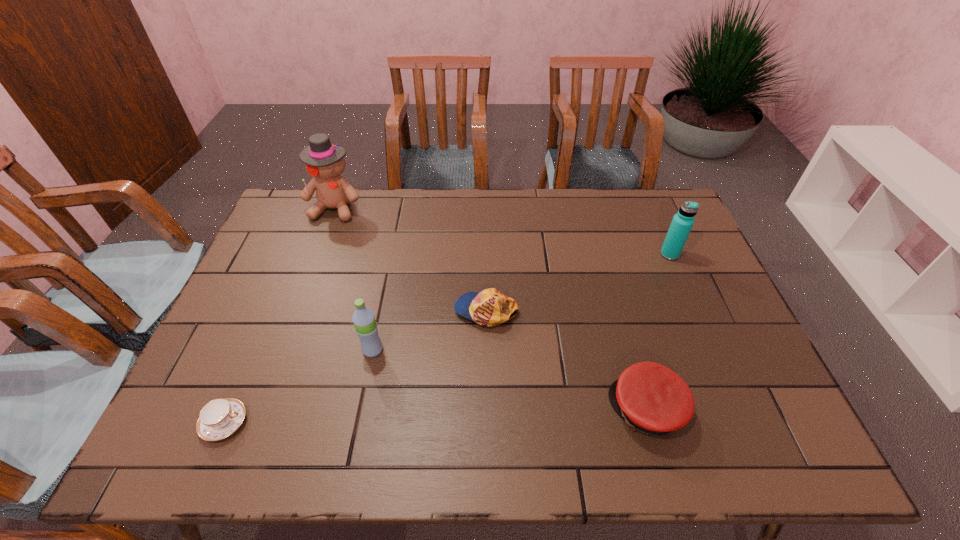
The image size is (960, 540). What are the coordinates of `free space located on the side with the handle of the shortest object` in the screenshot? It's located at (406, 423).

Locate an element on the screen. object that is positioned at the far edge is located at coordinates (324, 161).

The height and width of the screenshot is (540, 960). I want to click on cap that is at the near edge, so click(x=651, y=398).

In order to click on teacup positioned at the near edge in this screenshot , I will do `click(219, 418)`.

This screenshot has height=540, width=960. I want to click on rag_doll present at the left edge, so click(x=324, y=161).

Identify the location of teacup situated at the left edge. The width and height of the screenshot is (960, 540). (219, 418).

Locate an element on the screen. The image size is (960, 540). object present at the right edge is located at coordinates (682, 222).

Identify the location of object located at the far left corner. The image size is (960, 540). (324, 161).

The height and width of the screenshot is (540, 960). Find the location of `object that is at the near left corner`. object that is at the near left corner is located at coordinates (219, 418).

Where is `free space at the far edge of the desktop`? The width and height of the screenshot is (960, 540). free space at the far edge of the desktop is located at coordinates (376, 201).